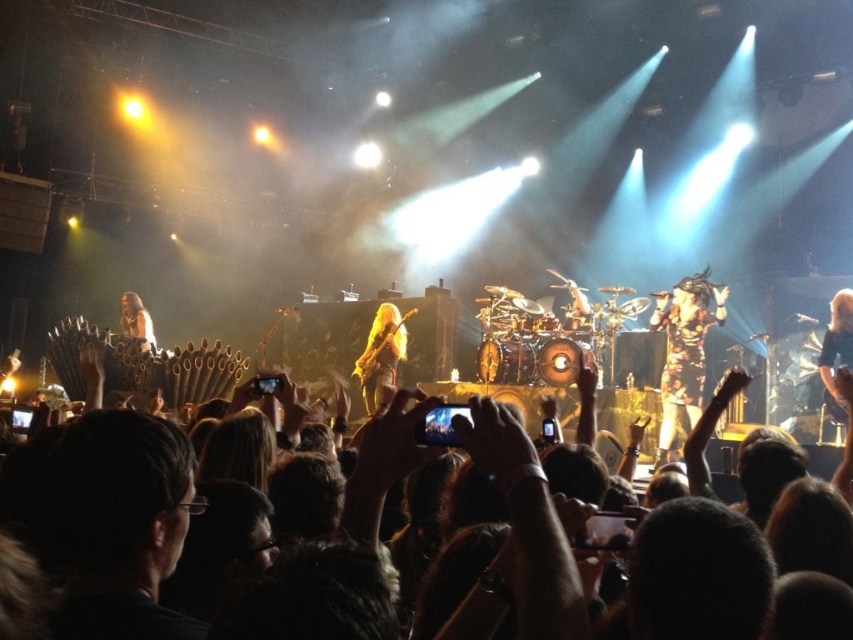
Question: Is shiny gold guitar at center below long hair at center?

Choices:
 (A) yes
 (B) no

Answer: (A)

Question: Which is nearer to the dark hair at lower center?

Choices:
 (A) floral-patterned dress at center
 (B) shiny gold guitar at center

Answer: (A)

Question: Which of the following is the farthest from the observer?

Choices:
 (A) (689, 280)
 (B) (753, 568)
 (C) (369, 369)

Answer: (C)

Question: Is dark hair at lower center further to the viewer compared to long hair at center?

Choices:
 (A) yes
 (B) no

Answer: (B)

Question: Does floral-patterned dress at center have a larger size compared to long hair at center?

Choices:
 (A) no
 (B) yes

Answer: (B)

Question: Which object appears farthest from the camera in this image?

Choices:
 (A) floral-patterned dress at center
 (B) long hair at center
 (C) shiny gold guitar at center
 (D) dark hair at lower center

Answer: (B)